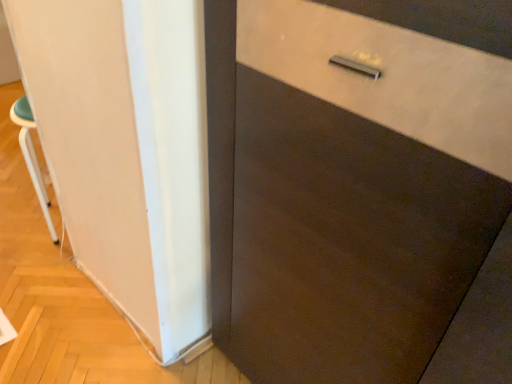
Find the location of a particular element. The height and width of the screenshot is (384, 512). white plastic stool at left is located at coordinates (32, 156).

What is the approximate width of white plastic stool at left?

The width of white plastic stool at left is 12.55 centimeters.

What do you see at coordinates (32, 156) in the screenshot? The image size is (512, 384). I see `white plastic stool at left` at bounding box center [32, 156].

This screenshot has width=512, height=384. In order to click on white matte barn door at left in this screenshot , I will do `click(91, 141)`.

The width and height of the screenshot is (512, 384). What do you see at coordinates (91, 141) in the screenshot?
I see `white matte barn door at left` at bounding box center [91, 141].

The image size is (512, 384). I want to click on white plastic stool at left, so click(x=32, y=156).

Is white plastic stool at left to the left or to the right of white matte barn door at left in the image?

white plastic stool at left is to the left of white matte barn door at left.

Which object is more forward, white plastic stool at left or white matte barn door at left?

white matte barn door at left.

Considering the points (34, 177) and (102, 286), which point is in front, point (34, 177) or point (102, 286)?

Positioned in front is point (102, 286).

From the image's perspective, which is above, white plastic stool at left or white matte barn door at left?

white plastic stool at left.

From a real-world perspective, between white plastic stool at left and white matte barn door at left, who is vertically higher?

In real-world perspective, white matte barn door at left is above.

Considering the sizes of objects white plastic stool at left and white matte barn door at left in the image provided, who is wider, white plastic stool at left or white matte barn door at left?

white plastic stool at left.

Is white plastic stool at left taller than white matte barn door at left?

In fact, white plastic stool at left may be shorter than white matte barn door at left.

Does white plastic stool at left have a smaller size compared to white matte barn door at left?

No, white plastic stool at left is not smaller than white matte barn door at left.

Is white plastic stool at left positioned beyond the bounds of white matte barn door at left?

Yes, white plastic stool at left is not within white matte barn door at left.

Looking at this image, can you see white plastic stool at left touching white matte barn door at left?

There is a gap between white plastic stool at left and white matte barn door at left.

Could you tell me if white plastic stool at left is turned towards white matte barn door at left?

No, white plastic stool at left is not facing towards white matte barn door at left.

How many degrees apart are the facing directions of white plastic stool at left and white matte barn door at left?

89.2 degrees separate the facing orientations of white plastic stool at left and white matte barn door at left.

How distant is white plastic stool at left from white matte barn door at left?

white plastic stool at left and white matte barn door at left are 16.51 inches apart from each other.

You are a GUI agent. You are given a task and a screenshot of the screen. Output one action in this format:
    pyautogui.click(x=<x>, y=<y>)
    Task: Click on the barn door that appears below the white plastic stool at left (from the image's perspective)
    This screenshot has width=512, height=384.
    Given the screenshot: What is the action you would take?
    pyautogui.click(x=91, y=141)

Considering the relative positions of white matte barn door at left and white plastic stool at left in the image provided, is white matte barn door at left to the right of white plastic stool at left from the viewer's perspective?

Correct, you'll find white matte barn door at left to the right of white plastic stool at left.

Between white matte barn door at left and white plastic stool at left, which one is positioned behind?

white plastic stool at left is behind.

Which is closer, (x=39, y=7) or (x=26, y=152)?

Positioned in front is point (x=39, y=7).

From the image's perspective, is white matte barn door at left located above or below white plastic stool at left?

Based on their image positions, white matte barn door at left is located beneath white plastic stool at left.

From a real-world perspective, is white matte barn door at left positioned above or below white plastic stool at left?

white matte barn door at left is situated higher than white plastic stool at left in the real world.

Which of these two, white matte barn door at left or white plastic stool at left, is thinner?

With smaller width is white matte barn door at left.

Which of these two, white matte barn door at left or white plastic stool at left, stands taller?

white matte barn door at left is taller.

Between white matte barn door at left and white plastic stool at left, which one has larger size?

Bigger between the two is white plastic stool at left.

Does white matte barn door at left contain white plastic stool at left?

No, white matte barn door at left does not contain white plastic stool at left.

Is white matte barn door at left next to white plastic stool at left and touching it?

No, white matte barn door at left is not next to white plastic stool at left.

Is white matte barn door at left oriented away from white plastic stool at left?

That's right, white matte barn door at left is facing away from white plastic stool at left.

Can you tell me how much white matte barn door at left and white plastic stool at left differ in facing direction?

They differ by 89.2 degrees in their facing directions.

Image resolution: width=512 pixels, height=384 pixels. There is a white plastic stool at left. What are the coordinates of `barn door above it (from a real-world perspective)` in the screenshot? It's located at 91,141.

This screenshot has width=512, height=384. I want to click on furniture on the left side of white matte barn door at left, so [32, 156].

Image resolution: width=512 pixels, height=384 pixels. I want to click on barn door in front of the white plastic stool at left, so click(91, 141).